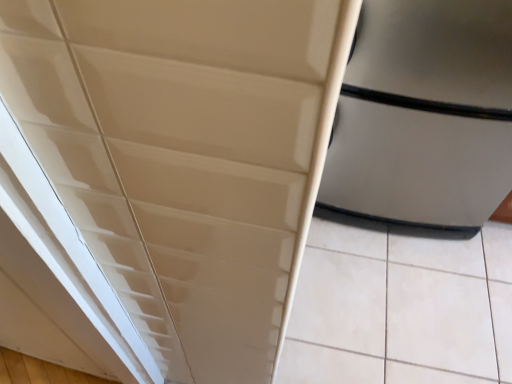
Describe the element at coordinates (424, 114) in the screenshot. I see `satin silver refrigerator at right` at that location.

You are a GUI agent. You are given a task and a screenshot of the screen. Output one action in this format:
    pyautogui.click(x=<x>, y=<y>)
    Task: Click on the satin silver refrigerator at right
    
    Given the screenshot: What is the action you would take?
    pyautogui.click(x=424, y=114)

Measure the distance between satin silver refrigerator at right and camera.

satin silver refrigerator at right and camera are 31.56 inches apart from each other.

Where is `satin silver refrigerator at right`? Image resolution: width=512 pixels, height=384 pixels. satin silver refrigerator at right is located at coordinates (424, 114).